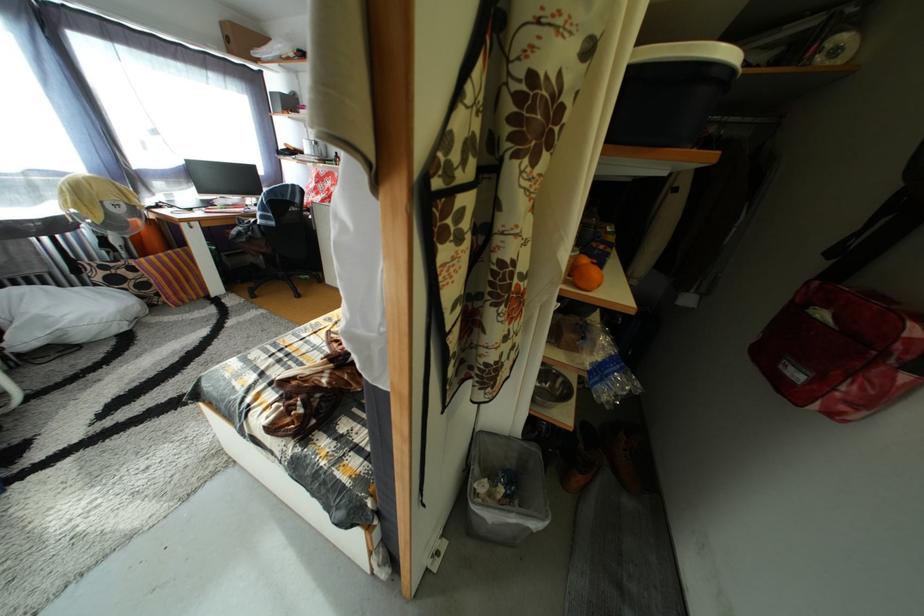
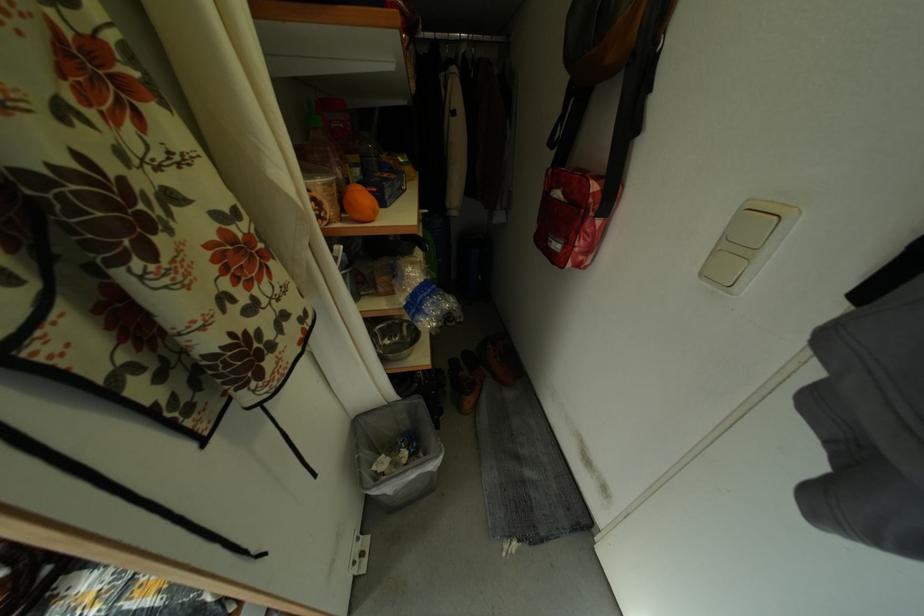
Where in the second image is the point corresponding to (x=511, y=496) from the first image?

(414, 460)